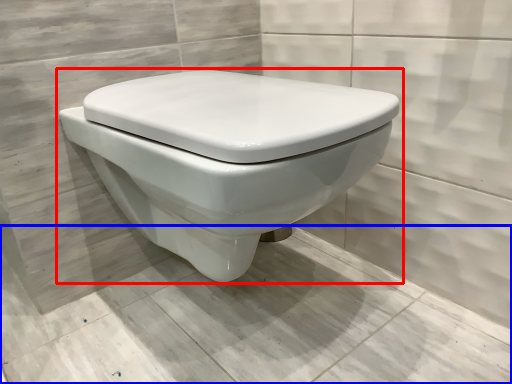
Question: Which object is closer to the camera taking this photo, toilet (highlighted by a red box) or concrete (highlighted by a blue box)?

Choices:
 (A) toilet
 (B) concrete

Answer: (B)